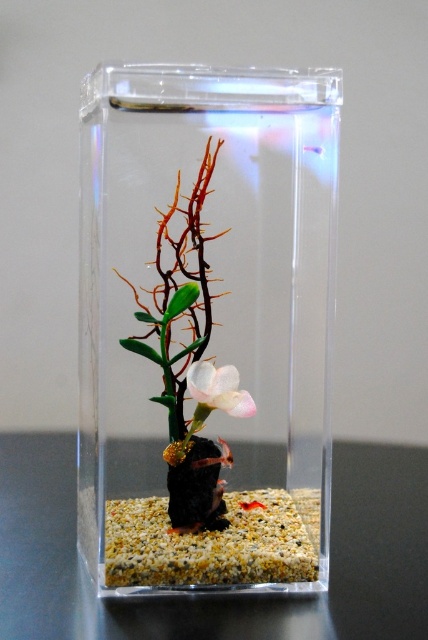
Question: Does transparent plastic glass box at center have a greater width compared to gravelly sand bed at center?

Choices:
 (A) no
 (B) yes

Answer: (B)

Question: Which is farther from the white matte flower at center?

Choices:
 (A) gravelly sand bed at center
 (B) transparent plastic glass box at center

Answer: (B)

Question: Does transparent plastic glass box at center come behind gravelly sand bed at center?

Choices:
 (A) yes
 (B) no

Answer: (B)

Question: Which is farther from the transparent plastic glass box at center?

Choices:
 (A) white matte flower at center
 (B) gravelly sand bed at center

Answer: (B)

Question: Which object is the farthest from the gravelly sand bed at center?

Choices:
 (A) white matte flower at center
 (B) transparent plastic glass box at center

Answer: (B)

Question: Can you confirm if transparent plastic glass box at center is positioned below gravelly sand bed at center?

Choices:
 (A) no
 (B) yes

Answer: (A)